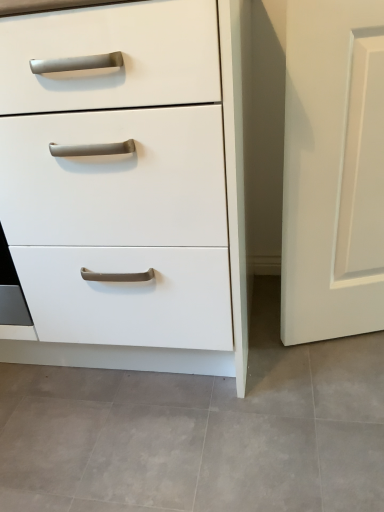
Identify the location of white matte chest of drawers at center. (229, 247).

Describe the element at coordinates (229, 247) in the screenshot. I see `white matte chest of drawers at center` at that location.

Locate an element on the screen. white matte chest of drawers at center is located at coordinates (229, 247).